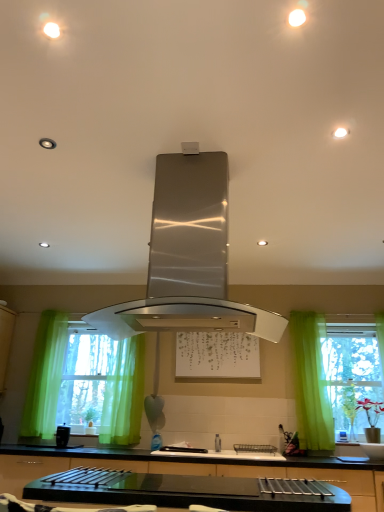
Question: Based on their positions, is green sheer curtain at right, acting as the first curtain starting from the right, located to the left or right of black glossy countertop at center?

Choices:
 (A) left
 (B) right

Answer: (B)

Question: Which is correct: green sheer curtain at right, acting as the 2th curtain starting from the left, is inside black glossy countertop at center, or outside of it?

Choices:
 (A) inside
 (B) outside

Answer: (B)

Question: Which of these objects is positioned farthest from the satin nickel faucet at center?

Choices:
 (A) black glossy countertop at center
 (B) satin silver range hood at center
 (C) green sheer curtain at center, which is the first curtain from left to right
 (D) matte black coffee maker at lower left
 (E) green sheer curtains at left

Answer: (B)

Question: Considering the real-world distances, which object is closest to the white matte bulletin board at center?

Choices:
 (A) satin silver range hood at center
 (B) matte black coffee maker at lower left
 (C) black glossy countertop at center
 (D) green sheer curtain at right, acting as the first curtain starting from the right
 (E) green sheer curtains at left

Answer: (D)